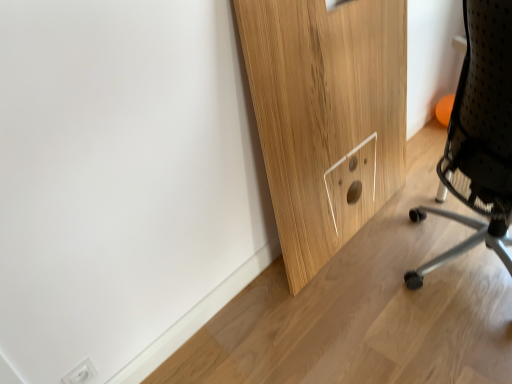
Question: Does black mesh chair at right have a greater width compared to white plastic electric outlet at lower left?

Choices:
 (A) yes
 (B) no

Answer: (A)

Question: Can you confirm if black mesh chair at right is thinner than white plastic electric outlet at lower left?

Choices:
 (A) yes
 (B) no

Answer: (B)

Question: From a real-world perspective, is black mesh chair at right located higher than white plastic electric outlet at lower left?

Choices:
 (A) yes
 (B) no

Answer: (A)

Question: From the image's perspective, is black mesh chair at right located above white plastic electric outlet at lower left?

Choices:
 (A) no
 (B) yes

Answer: (B)

Question: Is the depth of black mesh chair at right less than that of white plastic electric outlet at lower left?

Choices:
 (A) no
 (B) yes

Answer: (B)

Question: Is black mesh chair at right behind white plastic electric outlet at lower left?

Choices:
 (A) no
 (B) yes

Answer: (A)

Question: Is white plastic electric outlet at lower left facing towards black mesh chair at right?

Choices:
 (A) yes
 (B) no

Answer: (B)

Question: Is white plastic electric outlet at lower left positioned with its back to black mesh chair at right?

Choices:
 (A) yes
 (B) no

Answer: (B)

Question: Can you confirm if white plastic electric outlet at lower left is smaller than black mesh chair at right?

Choices:
 (A) no
 (B) yes

Answer: (B)

Question: From a real-world perspective, is white plastic electric outlet at lower left beneath black mesh chair at right?

Choices:
 (A) yes
 (B) no

Answer: (A)

Question: Can you confirm if white plastic electric outlet at lower left is bigger than black mesh chair at right?

Choices:
 (A) yes
 (B) no

Answer: (B)

Question: Is white plastic electric outlet at lower left positioned far away from black mesh chair at right?

Choices:
 (A) yes
 (B) no

Answer: (A)

Question: From the image's perspective, is white plastic electric outlet at lower left positioned above or below black mesh chair at right?

Choices:
 (A) below
 (B) above

Answer: (A)